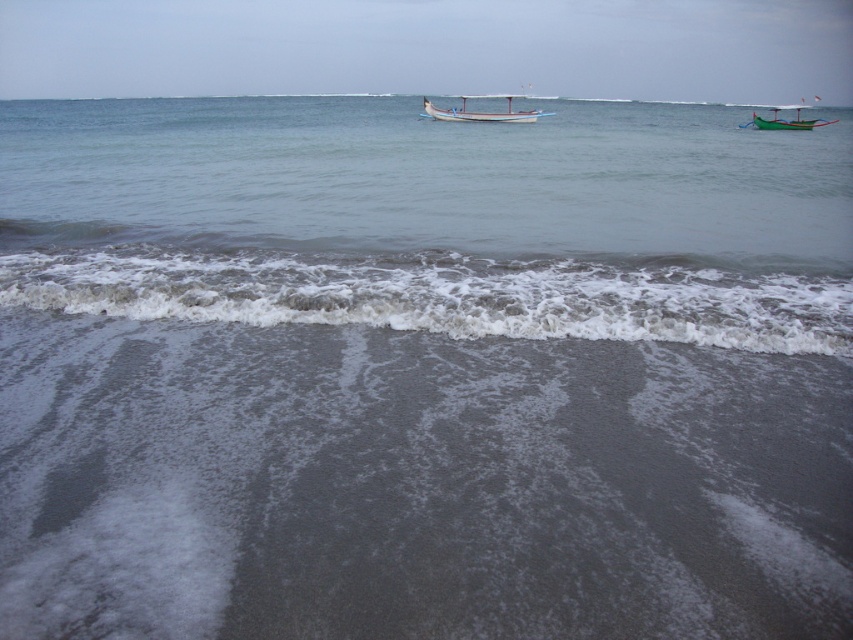
Question: Is gray matte water at center above white wooden boat at center?

Choices:
 (A) no
 (B) yes

Answer: (A)

Question: Which of the following is the closest to the observer?

Choices:
 (A) gray matte water at center
 (B) white wooden boat at center

Answer: (A)

Question: Does gray matte water at center have a smaller size compared to green wooden boat at upper right?

Choices:
 (A) yes
 (B) no

Answer: (A)

Question: Among these points, which one is nearest to the camera?

Choices:
 (A) (16, 252)
 (B) (567, 156)

Answer: (A)

Question: Which object is closer to the camera taking this photo?

Choices:
 (A) gray matte sand at lower center
 (B) gray matte water at center
 (C) white wooden boat at center
 (D) green wooden boat at upper right

Answer: (A)

Question: Is gray matte water at center smaller than gray matte sand at lower center?

Choices:
 (A) no
 (B) yes

Answer: (A)